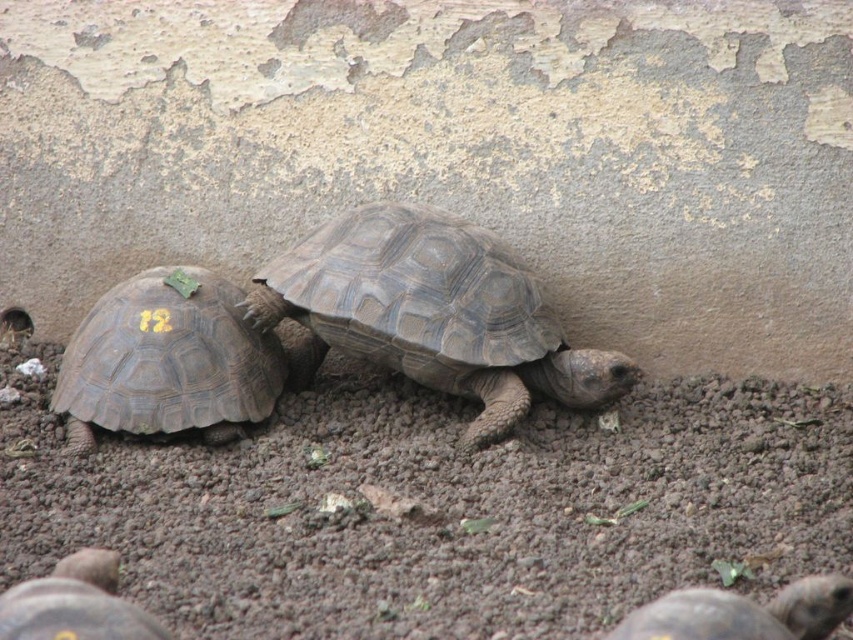
You are a zookeeper who needs to place a feeding dish between the dark brown textured shell at center and the dark brown shell at lower left. Which side should you place the dish closer to ensure it fits within the space between them?

The dark brown textured shell at center might be wider than dark brown shell at lower left, so placing the feeding dish closer to the dark brown shell at lower left would ensure it fits within the space between them.

You are a zookeeper observing two tortoises in their enclosure. You notice the dark brown textured shell at center and the dark brown shell at lower left. Which tortoise has a larger shell?

The dark brown textured shell at center is larger in size than the dark brown shell at lower left.

You are a photographer adjusting your camera to focus on two points in the image. The first point is labeled as point (376, 333) and the second is point (213, 308). Which point should you focus on first if you want to capture the closest object to the camera?

Point (376, 333) is closer to the camera than point (213, 308), so you should focus on point (376, 333) first to capture the closest object.